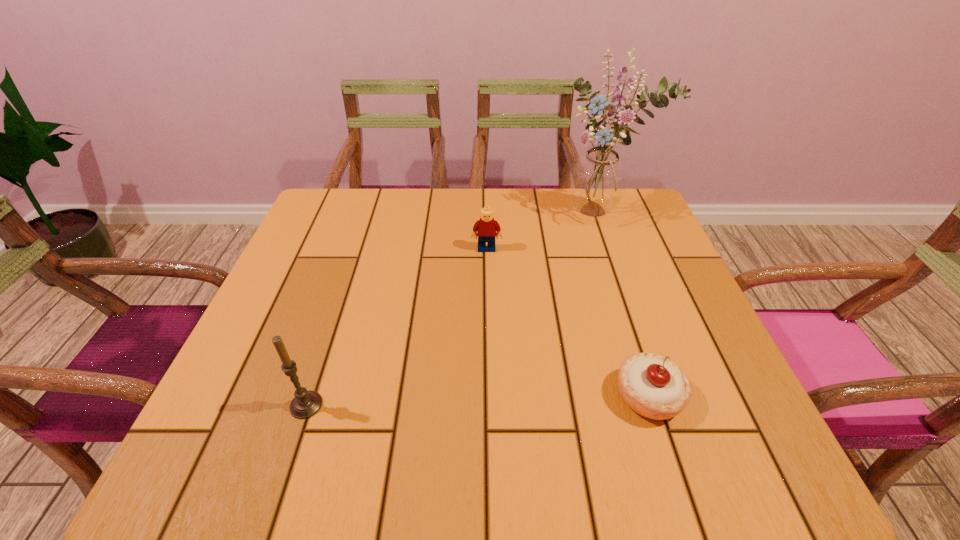
The height and width of the screenshot is (540, 960). Identify the location of vacant space located on the front-facing side of the third object from right to left. (490, 395).

At what (x,y) coordinates should I click in order to perform the action: click on vacant space situated on the front-facing side of the third object from right to left. Please return your answer as a coordinate pair (x, y). The image size is (960, 540). Looking at the image, I should click on (488, 316).

At what (x,y) coordinates should I click in order to perform the action: click on blank space located 0.390m on the front-facing side of the tallest object. Please return your answer as a coordinate pair (x, y). The width and height of the screenshot is (960, 540). Looking at the image, I should click on (546, 334).

Where is `free location located 0.150m on the front-facing side of the tallest object`? This screenshot has height=540, width=960. free location located 0.150m on the front-facing side of the tallest object is located at coordinates (576, 263).

Find the location of a particular element. Image resolution: width=960 pixels, height=540 pixels. blank space located 0.330m on the front-facing side of the tallest object is located at coordinates (555, 314).

At what (x,y) coordinates should I click in order to perform the action: click on object at the far edge. Please return your answer as a coordinate pair (x, y). The image size is (960, 540). Looking at the image, I should click on (597, 181).

Where is `candle located at the near edge`? The image size is (960, 540). candle located at the near edge is located at coordinates (305, 404).

Where is `pastry that is at the near edge`? Image resolution: width=960 pixels, height=540 pixels. pastry that is at the near edge is located at coordinates (654, 387).

At what (x,y) coordinates should I click in order to perform the action: click on object located in the left edge section of the desktop. Please return your answer as a coordinate pair (x, y). This screenshot has width=960, height=540. Looking at the image, I should click on (305, 404).

Locate an element on the screen. This screenshot has width=960, height=540. pastry at the right edge is located at coordinates (654, 387).